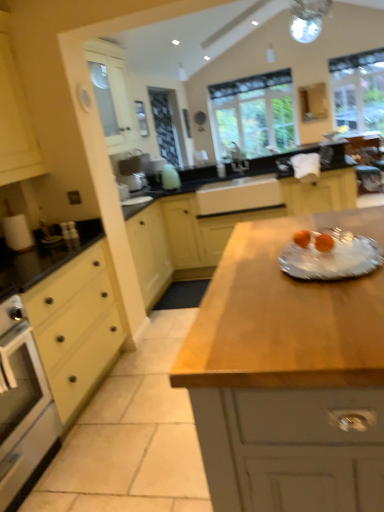
Question: Does clear glass window at center, which is the second window from right to left, turn towards yellow matte drawer at left?

Choices:
 (A) no
 (B) yes

Answer: (B)

Question: Is yellow matte drawer at left surrounded by clear glass window at center, which ranks as the first window in left-to-right order?

Choices:
 (A) no
 (B) yes

Answer: (A)

Question: Can you confirm if clear glass window at center, which ranks as the first window in left-to-right order, is positioned to the right of yellow matte drawer at left?

Choices:
 (A) yes
 (B) no

Answer: (A)

Question: Is clear glass window at center, which is the second window from right to left, closer to the viewer compared to yellow matte drawer at left?

Choices:
 (A) no
 (B) yes

Answer: (A)

Question: Can you confirm if clear glass window at center, which is the second window from right to left, is shorter than yellow matte drawer at left?

Choices:
 (A) yes
 (B) no

Answer: (B)

Question: From a real-world perspective, does clear glass window at center, which ranks as the first window in left-to-right order, sit lower than yellow matte drawer at left?

Choices:
 (A) no
 (B) yes

Answer: (A)

Question: Is clear glass window at upper right, which ranks as the 1th window in right-to-left order, looking in the opposite direction of white ceramic sink at center, positioned as the second sink in bottom-to-top order?

Choices:
 (A) yes
 (B) no

Answer: (B)

Question: Is clear glass window at upper right, which ranks as the 1th window in right-to-left order, to the left of white ceramic sink at center, positioned as the second sink in bottom-to-top order, from the viewer's perspective?

Choices:
 (A) no
 (B) yes

Answer: (A)

Question: From the image's perspective, does clear glass window at upper right, positioned as the 2th window in left-to-right order, appear lower than white ceramic sink at center, placed as the 1th sink when sorted from top to bottom?

Choices:
 (A) yes
 (B) no

Answer: (B)

Question: Can you confirm if clear glass window at upper right, positioned as the 2th window in left-to-right order, is wider than white ceramic sink at center, positioned as the second sink in bottom-to-top order?

Choices:
 (A) no
 (B) yes

Answer: (A)

Question: Considering the relative positions of clear glass window at upper right, positioned as the 2th window in left-to-right order, and white ceramic sink at center, placed as the 1th sink when sorted from top to bottom, in the image provided, is clear glass window at upper right, positioned as the 2th window in left-to-right order, to the right of white ceramic sink at center, placed as the 1th sink when sorted from top to bottom, from the viewer's perspective?

Choices:
 (A) yes
 (B) no

Answer: (A)

Question: Considering the relative sizes of clear glass window at upper right, positioned as the 2th window in left-to-right order, and white ceramic sink at center, positioned as the second sink in bottom-to-top order, in the image provided, is clear glass window at upper right, positioned as the 2th window in left-to-right order, thinner than white ceramic sink at center, positioned as the second sink in bottom-to-top order,?

Choices:
 (A) no
 (B) yes

Answer: (B)

Question: Does white ceramic sink at center, the 1th sink positioned from the bottom, appear on the left side of clear glass plate at center?

Choices:
 (A) no
 (B) yes

Answer: (B)